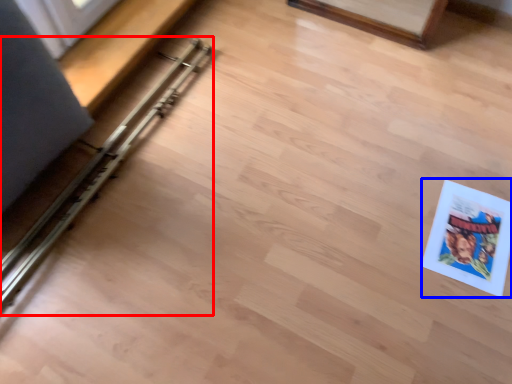
Question: Which of the following is the farthest to the observer, rail (highlighted by a red box) or comic book (highlighted by a blue box)?

Choices:
 (A) rail
 (B) comic book

Answer: (B)